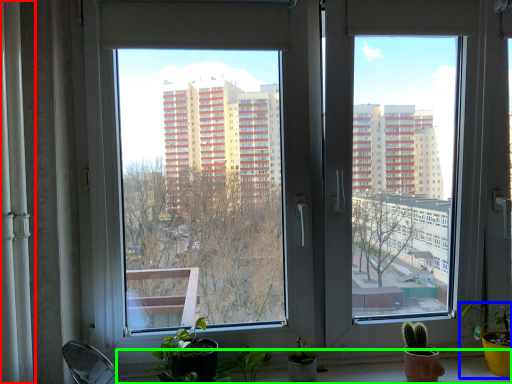
Question: Based on their relative distances, which object is nearer to curtain (highlighted by a red box)? Choose from houseplant (highlighted by a blue box) and window sill (highlighted by a green box).

Choices:
 (A) houseplant
 (B) window sill

Answer: (B)